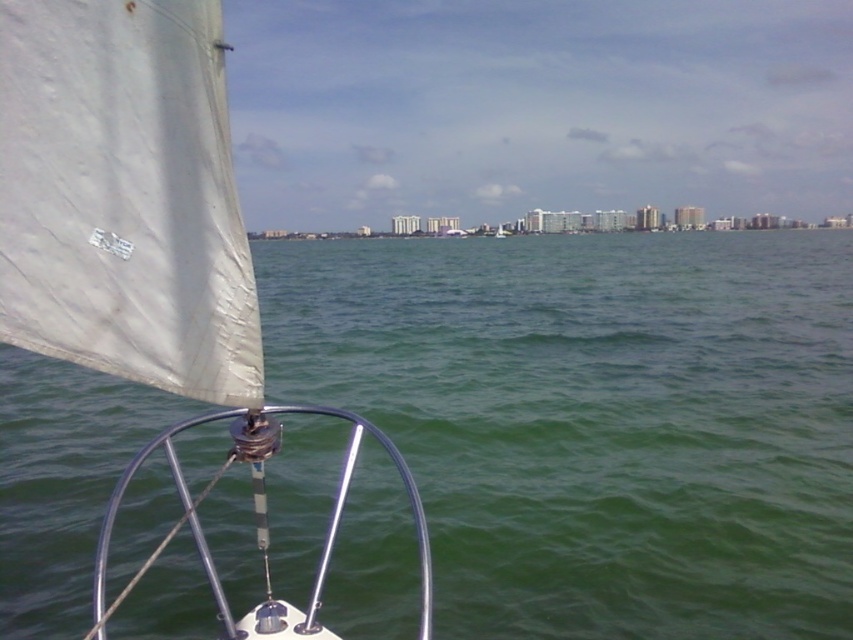
Question: Is green water at center bigger than white matte sail at center?

Choices:
 (A) yes
 (B) no

Answer: (A)

Question: Which of the following is the closest to the observer?

Choices:
 (A) (193, 308)
 (B) (442, 320)

Answer: (A)

Question: Among these points, which one is nearest to the camera?

Choices:
 (A) (694, 509)
 (B) (212, 72)

Answer: (B)

Question: Is green water at center above white matte sail at center?

Choices:
 (A) yes
 (B) no

Answer: (A)

Question: Does green water at center appear on the right side of white matte sail at center?

Choices:
 (A) yes
 (B) no

Answer: (A)